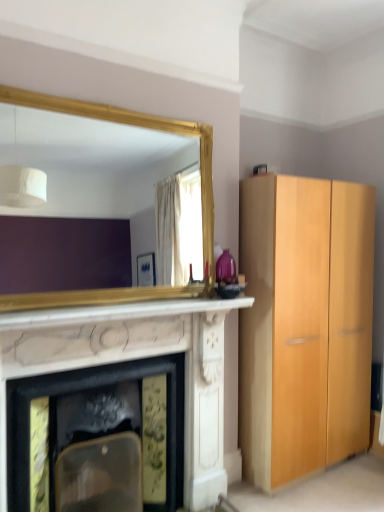
Question: Is white marble fireplace at center wider or thinner than white marble fireplace at center?

Choices:
 (A) wide
 (B) thin

Answer: (A)

Question: Is white marble fireplace at center taller or shorter than white marble fireplace at center?

Choices:
 (A) tall
 (B) short

Answer: (A)

Question: Based on their relative distances, which object is nearer to the gold-framed mirror at upper left?

Choices:
 (A) white marble fireplace at center
 (B) white marble fireplace at center

Answer: (A)

Question: Estimate the real-world distances between objects in this image. Which object is closer to the gold-framed mirror at upper left?

Choices:
 (A) white marble fireplace at center
 (B) white marble fireplace at center

Answer: (A)